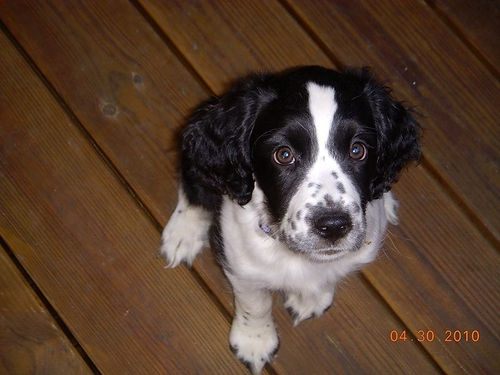
The image size is (500, 375). In order to click on wooden floor in this screenshot , I will do `click(109, 282)`.